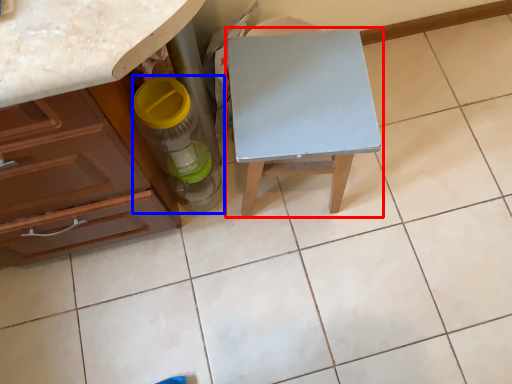
Question: Which object is closer to the camera taking this photo, table (highlighted by a red box) or bottle (highlighted by a blue box)?

Choices:
 (A) table
 (B) bottle

Answer: (B)